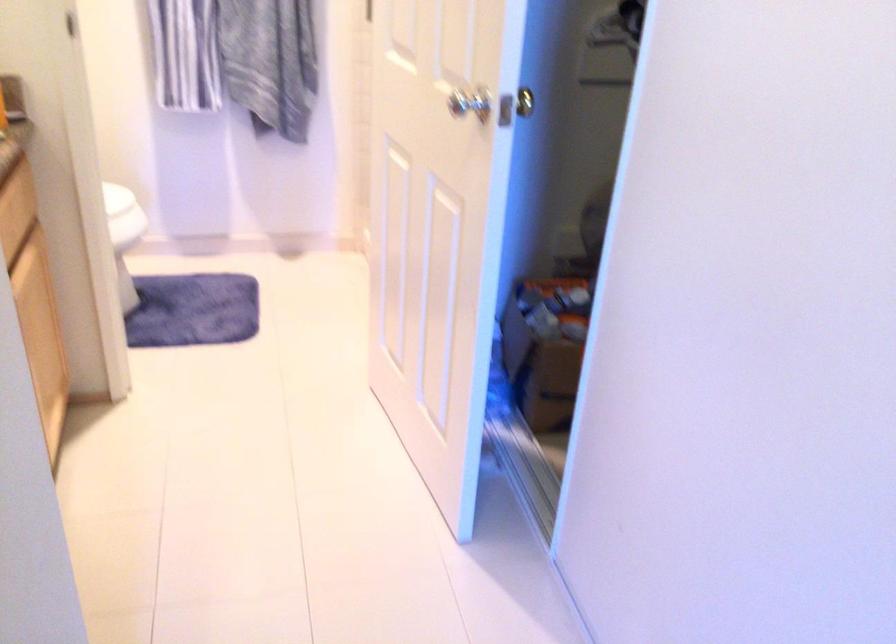
Where would you pull the cabinet drawer handle? Please return your answer as a coordinate pair (x, y).

(12, 229)